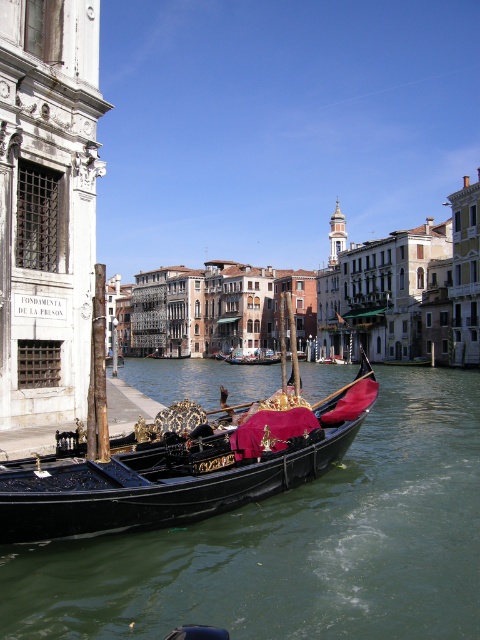
You are a tourist in Venice and want to take a photo of both the black polished gondola at lower left and the black velvet gondola at center. Since you want both boats to be clearly visible in the same frame, which gondola should you position closer to the camera to ensure both are visible without cropping?

To ensure both the black polished gondola at lower left and the black velvet gondola at center are visible in the same frame without cropping, position the smaller black velvet gondola at center closer to the camera. Since the black polished gondola at lower left is bigger than the black velvet gondola at center, the smaller one needs to be nearer to appear larger in the photo and balance visibility.

You are standing on the canal bank and see two gondolas, the black polished gondola at lower left and the black velvet gondola at center. Which gondola is nearer to you?

The black polished gondola at lower left is closer to the viewer than the black velvet gondola at center, so the black polished gondola at lower left is nearer to you.